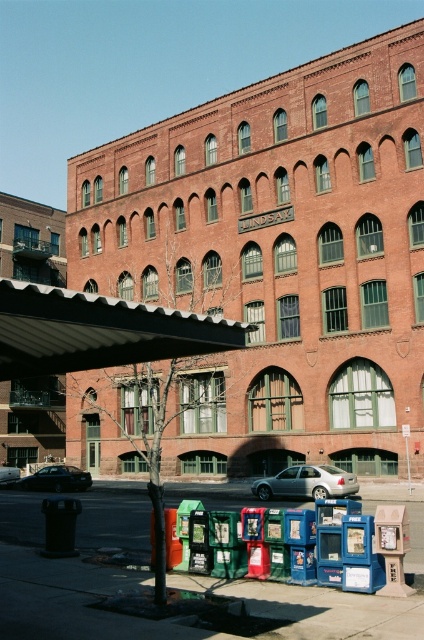
You are standing at the entrance of the building and want to park your car in a spot directly in front of the building. The parking spot is at coordinates 0.755, 0.724. Is the silver metallic sedan at center currently occupying that spot?

Yes, the silver metallic sedan at center is occupying the parking spot at coordinates (306, 483).

You are a pedestrian standing on the sidewalk in front of the building. You see the white corrugated awning at center and the silver metallic sedan at center. Is the awning above the sedan?

The white corrugated awning at center is positioned over silver metallic sedan at center, so yes, the awning is above the sedan.

You are a delivery person trying to park your van next to the shiny black sedan at center. The van is 2 meters wide. Can you park it there without overlapping the white corrugated awning at center?

The white corrugated awning at center has a smaller size compared to shiny black sedan at center, so the van can park next to the shiny black sedan at center without overlapping the awning.